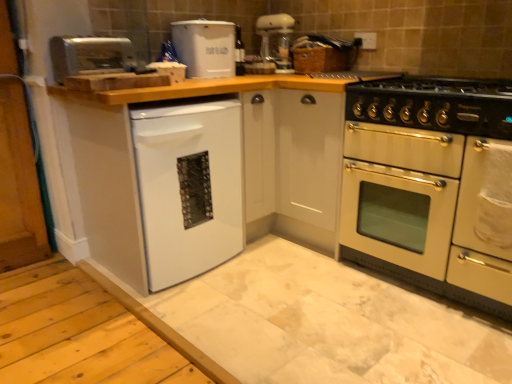
Where is `cream matte oven at right`? The height and width of the screenshot is (384, 512). cream matte oven at right is located at coordinates (426, 185).

The height and width of the screenshot is (384, 512). What are the coordinates of `matte white coffee machine at upper center` in the screenshot? It's located at (278, 40).

From a real-world perspective, is satin silver toaster at upper left, which ranks as the 2th appliance in back-to-front order, physically above black enamel gas stove at right?

Yes.

Who is more distant, satin silver toaster at upper left, which ranks as the 2th appliance in back-to-front order, or black enamel gas stove at right?

Positioned behind is satin silver toaster at upper left, which ranks as the 2th appliance in back-to-front order.

Which is less distant, (134,61) or (436,104)?

Point (134,61) is farther from the camera than point (436,104).

How much distance is there between satin silver toaster at upper left, which ranks as the 2th appliance in right-to-left order, and black enamel gas stove at right?

satin silver toaster at upper left, which ranks as the 2th appliance in right-to-left order, and black enamel gas stove at right are 1.28 meters apart.

Relative to matte white coffee machine at upper center, is white glossy dishwasher at lower left in front or behind?

white glossy dishwasher at lower left is in front of matte white coffee machine at upper center.

From a real-world perspective, is white glossy dishwasher at lower left located beneath matte white coffee machine at upper center?

Yes, from a real-world perspective, white glossy dishwasher at lower left is under matte white coffee machine at upper center.

Considering the points (194, 261) and (269, 19), which point is in front, point (194, 261) or point (269, 19)?

The point (194, 261) is closer to the camera.

What's the angular difference between white glossy dishwasher at lower left and matte white coffee machine at upper center's facing directions?

The angle between the facing direction of white glossy dishwasher at lower left and the facing direction of matte white coffee machine at upper center is 87.6 degrees.

Which object is further away from the camera taking this photo, white plastic bread bin at upper center, which ranks as the first appliance in right-to-left order, or white glossy dishwasher at lower left?

white plastic bread bin at upper center, which ranks as the first appliance in right-to-left order, is further away from the camera.

Between white plastic bread bin at upper center, which appears as the second appliance when viewed from the front, and white glossy dishwasher at lower left, which one appears on the right side from the viewer's perspective?

white plastic bread bin at upper center, which appears as the second appliance when viewed from the front.

Which of these two, white plastic bread bin at upper center, which appears as the second appliance when viewed from the front, or white glossy dishwasher at lower left, is wider?

With larger width is white glossy dishwasher at lower left.

Does white plastic bread bin at upper center, which ranks as the first appliance in right-to-left order, have a larger size compared to white glossy dishwasher at lower left?

Actually, white plastic bread bin at upper center, which ranks as the first appliance in right-to-left order, might be smaller than white glossy dishwasher at lower left.

From the image's perspective, who appears lower, white plastic bread bin at upper center, which appears as the second appliance when viewed from the front, or satin silver toaster at upper left, the first appliance viewed from the front?

satin silver toaster at upper left, the first appliance viewed from the front, is shown below in the image.

From a real-world perspective, is white plastic bread bin at upper center, the 2th appliance from the left, physically located above or below satin silver toaster at upper left, which ranks as the 2th appliance in right-to-left order?

From a real-world perspective, white plastic bread bin at upper center, the 2th appliance from the left, is physically above satin silver toaster at upper left, which ranks as the 2th appliance in right-to-left order.

Which of these two, white plastic bread bin at upper center, which ranks as the first appliance in right-to-left order, or satin silver toaster at upper left, the first appliance in the left-to-right sequence, is bigger?

With larger size is white plastic bread bin at upper center, which ranks as the first appliance in right-to-left order.

How different are the orientations of white plastic bread bin at upper center, the 2th appliance from the left, and satin silver toaster at upper left, the first appliance in the left-to-right sequence, in degrees?

They differ by 2.1 degrees in their facing directions.

Which point is more forward, (183, 174) or (488, 111)?

The point (488, 111) is closer to the camera.

Considering the sizes of objects white glossy dishwasher at lower left and cream matte oven at right in the image provided, who is wider, white glossy dishwasher at lower left or cream matte oven at right?

With larger width is cream matte oven at right.

Between white glossy dishwasher at lower left and cream matte oven at right, which one appears on the left side from the viewer's perspective?

white glossy dishwasher at lower left.

Who is smaller, white glossy dishwasher at lower left or cream matte oven at right?

With smaller size is white glossy dishwasher at lower left.

Does matte white coffee machine at upper center appear on the right side of satin silver toaster at upper left, the first appliance viewed from the front?

Yes.

Does matte white coffee machine at upper center contain satin silver toaster at upper left, the first appliance viewed from the front?

Definitely not — satin silver toaster at upper left, the first appliance viewed from the front, is not inside matte white coffee machine at upper center.

Is matte white coffee machine at upper center turned away from satin silver toaster at upper left, the first appliance viewed from the front?

No, matte white coffee machine at upper center's orientation is not away from satin silver toaster at upper left, the first appliance viewed from the front.

Looking at this image, is matte white coffee machine at upper center wider than satin silver toaster at upper left, which ranks as the 2th appliance in right-to-left order?

In fact, matte white coffee machine at upper center might be narrower than satin silver toaster at upper left, which ranks as the 2th appliance in right-to-left order.

Which is behind, point (201, 106) or point (415, 124)?

The point (201, 106) is behind.

Looking at this image, measure the distance between white glossy dishwasher at lower left and black enamel gas stove at right.

white glossy dishwasher at lower left and black enamel gas stove at right are 33.30 inches apart from each other.

Which object is closer to the camera taking this photo, white glossy dishwasher at lower left or black enamel gas stove at right?

Positioned in front is black enamel gas stove at right.

Who is shorter, white glossy dishwasher at lower left or black enamel gas stove at right?

With less height is black enamel gas stove at right.

Where is `gas stove on the right of the satin silver toaster at upper left, which ranks as the 2th appliance in back-to-front order`? Image resolution: width=512 pixels, height=384 pixels. gas stove on the right of the satin silver toaster at upper left, which ranks as the 2th appliance in back-to-front order is located at coordinates (435, 104).

Image resolution: width=512 pixels, height=384 pixels. Identify the location of dish washer below the matte white coffee machine at upper center (from a real-world perspective). (189, 187).

Which object lies nearer to the anchor point white glossy dishwasher at lower left, black enamel gas stove at right or white matte dishwasher at lower left?

white matte dishwasher at lower left is positioned closer to the anchor white glossy dishwasher at lower left.

When comparing their distances from white plastic bread bin at upper center, which appears as the second appliance when viewed from the front, does matte white coffee machine at upper center or cream matte oven at right seem further?

Answer: cream matte oven at right lies further to white plastic bread bin at upper center, which appears as the second appliance when viewed from the front, than the other object.

Estimate the real-world distances between objects in this image. Which object is closer to white plastic bread bin at upper center, which appears as the second appliance when viewed from the front, cream matte oven at right or matte white coffee machine at upper center?

matte white coffee machine at upper center is positioned closer to the anchor white plastic bread bin at upper center, which appears as the second appliance when viewed from the front.

Based on their spatial positions, is matte white coffee machine at upper center or cream matte oven at right further from white matte dishwasher at lower left?

matte white coffee machine at upper center.

When comparing their distances from matte white coffee machine at upper center, does white matte dishwasher at lower left or white plastic bread bin at upper center, the 2th appliance from the left, seem closer?

Based on the image, white plastic bread bin at upper center, the 2th appliance from the left, appears to be nearer to matte white coffee machine at upper center.

From the picture: Considering their positions, is white plastic bread bin at upper center, which appears as the second appliance when viewed from the front, positioned further to cream matte oven at right than white matte dishwasher at lower left?

white plastic bread bin at upper center, which appears as the second appliance when viewed from the front, lies further to cream matte oven at right than the other object.

Estimate the real-world distances between objects in this image. Which object is closer to matte white coffee machine at upper center, white matte dishwasher at lower left or white glossy dishwasher at lower left?

white matte dishwasher at lower left.

Which object lies nearer to the anchor point white matte dishwasher at lower left, matte white coffee machine at upper center or black enamel gas stove at right?

black enamel gas stove at right lies closer to white matte dishwasher at lower left than the other object.

Image resolution: width=512 pixels, height=384 pixels. Identify the location of dish washer situated between satin silver toaster at upper left, the first appliance viewed from the front, and white matte dishwasher at lower left from left to right. (189, 187).

This screenshot has width=512, height=384. In order to click on gas stove located between white matte dishwasher at lower left and matte white coffee machine at upper center in the depth direction in this screenshot , I will do `click(435, 104)`.

Where is `gas stove between white matte dishwasher at lower left and cream matte oven at right in the horizontal direction`? Image resolution: width=512 pixels, height=384 pixels. gas stove between white matte dishwasher at lower left and cream matte oven at right in the horizontal direction is located at coordinates (435, 104).

The width and height of the screenshot is (512, 384). Find the location of `appliance positioned between white matte dishwasher at lower left and white plastic bread bin at upper center, the 2th appliance from the left, from near to far`. appliance positioned between white matte dishwasher at lower left and white plastic bread bin at upper center, the 2th appliance from the left, from near to far is located at coordinates (90, 56).